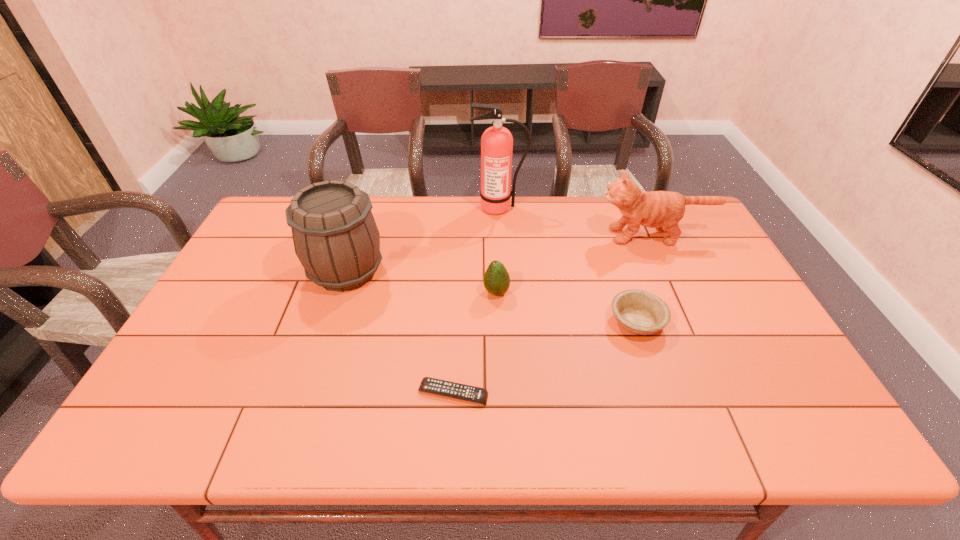
Locate an element on the screen. free spot located on the face of the cat is located at coordinates (553, 235).

Where is `free space located on the face of the cat`? free space located on the face of the cat is located at coordinates (544, 235).

What are the coordinates of `vacant point located on the face of the cat` in the screenshot? It's located at (501, 235).

The height and width of the screenshot is (540, 960). In order to click on free location located 0.220m on the back of the fourth tallest object in this screenshot , I will do `click(494, 237)`.

Where is `vacant space located 0.190m on the back of the bowl`? This screenshot has width=960, height=540. vacant space located 0.190m on the back of the bowl is located at coordinates (614, 257).

I want to click on free space located 0.370m on the right of the shortest object, so click(650, 393).

You are a GUI agent. You are given a task and a screenshot of the screen. Output one action in this format:
    pyautogui.click(x=<x>, y=<y>)
    Task: Click on the fire extinguisher present at the far edge
    The width and height of the screenshot is (960, 540).
    Given the screenshot: What is the action you would take?
    [x=496, y=142]

Identify the location of cat positioned at the far edge. (663, 210).

The image size is (960, 540). Find the location of `object that is at the near edge`. object that is at the near edge is located at coordinates (479, 395).

This screenshot has width=960, height=540. I want to click on object located at the right edge, so click(x=663, y=210).